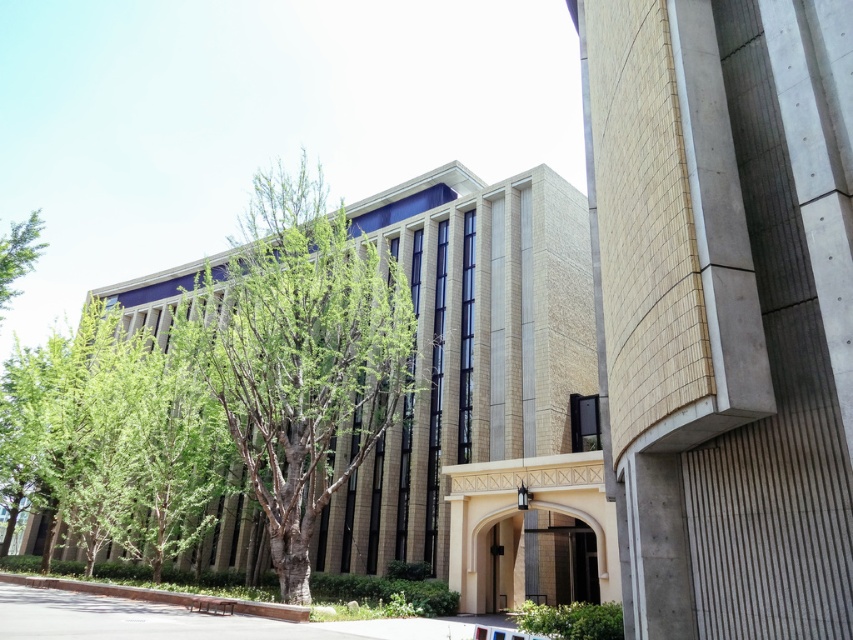
Between smooth concrete pavement at lower center and smooth wooden door at center, which one appears on the right side from the viewer's perspective?

smooth wooden door at center

At what (x,y) coordinates should I click in order to perform the action: click on smooth concrete pavement at lower center. Please return your answer as a coordinate pair (x, y). The height and width of the screenshot is (640, 853). Looking at the image, I should click on (175, 616).

You are a GUI agent. You are given a task and a screenshot of the screen. Output one action in this format:
    pyautogui.click(x=<x>, y=<y>)
    Task: Click on the smooth concrete pavement at lower center
    The height and width of the screenshot is (640, 853).
    Given the screenshot: What is the action you would take?
    pyautogui.click(x=175, y=616)

Can you confirm if smooth wooden door at center is positioned to the left of green leafy tree at left?

In fact, smooth wooden door at center is to the right of green leafy tree at left.

From the picture: Who is more distant from viewer, (605, 556) or (32, 264)?

Positioned behind is point (32, 264).

Find the location of a particular element. smooth wooden door at center is located at coordinates (477, 541).

Who is positioned more to the right, green leafy tree at center or smooth concrete pavement at lower center?

From the viewer's perspective, green leafy tree at center appears more on the right side.

Is green leafy tree at center to the right of smooth concrete pavement at lower center from the viewer's perspective?

Yes, green leafy tree at center is to the right of smooth concrete pavement at lower center.

The image size is (853, 640). What are the coordinates of `green leafy tree at center` in the screenshot? It's located at (300, 355).

This screenshot has width=853, height=640. In order to click on green leafy tree at center in this screenshot , I will do `click(300, 355)`.